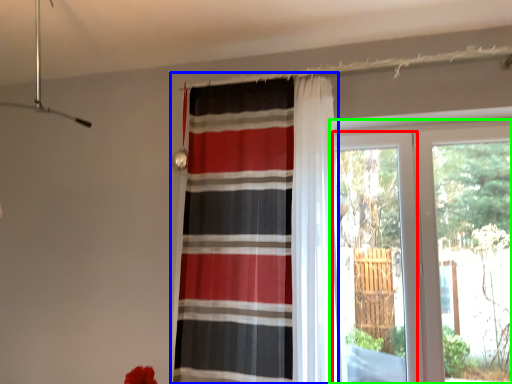
Question: Which object is positioned farthest from screen door (highlighted by a red box)? Select from curtain (highlighted by a blue box) and window (highlighted by a green box).

Choices:
 (A) curtain
 (B) window

Answer: (A)